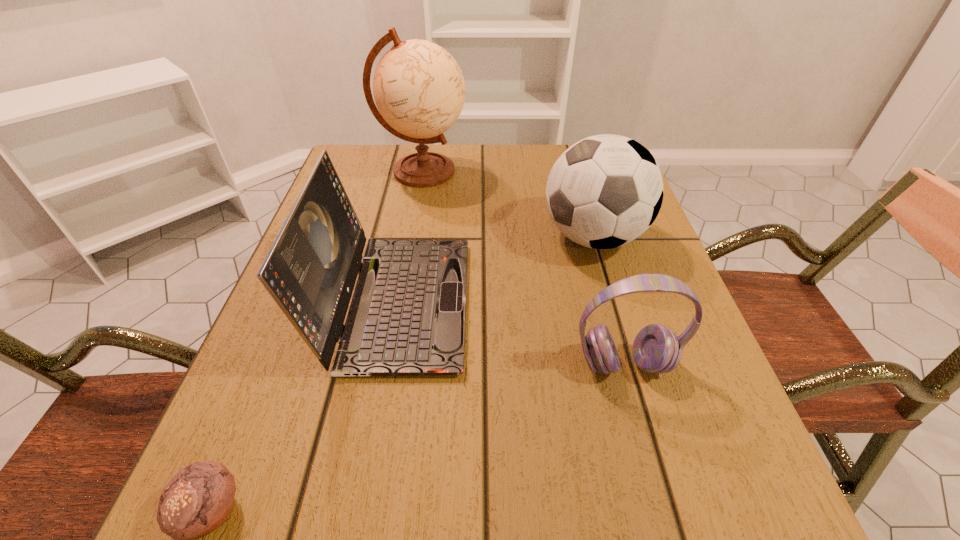
Identify the location of vacant space at the far left corner of the desktop. The image size is (960, 540). tap(362, 162).

In the image, there is a desktop. At what (x,y) coordinates should I click in order to perform the action: click on vacant area at the far right corner. Please return your answer as a coordinate pair (x, y). Image resolution: width=960 pixels, height=540 pixels. Looking at the image, I should click on (557, 144).

This screenshot has height=540, width=960. I want to click on free space between the tallest object and the laptop computer, so click(410, 237).

Find the location of a particular element. This screenshot has height=540, width=960. free spot between the soccer ball and the tallest object is located at coordinates (508, 204).

The width and height of the screenshot is (960, 540). What are the coordinates of `empty location between the fourth tallest object and the globe` in the screenshot? It's located at (523, 268).

The image size is (960, 540). I want to click on free space between the soccer ball and the laptop computer, so pyautogui.click(x=495, y=269).

I want to click on free spot between the globe and the soccer ball, so click(x=508, y=204).

Where is `vacant point located between the second shortest object and the laptop computer`? The image size is (960, 540). vacant point located between the second shortest object and the laptop computer is located at coordinates (511, 333).

Locate which object ranks third in proximity to the laptop computer. Please provide its 2D coordinates. Your answer should be formatted as a tuple, i.e. [(x, y)], where the tuple contains the x and y coordinates of a point satisfying the conditions above.

[(656, 349)]

You are a GUI agent. You are given a task and a screenshot of the screen. Output one action in this format:
    pyautogui.click(x=<x>, y=<y>)
    Task: Click on the third closest object relative to the headset
    
    Given the screenshot: What is the action you would take?
    pyautogui.click(x=198, y=499)